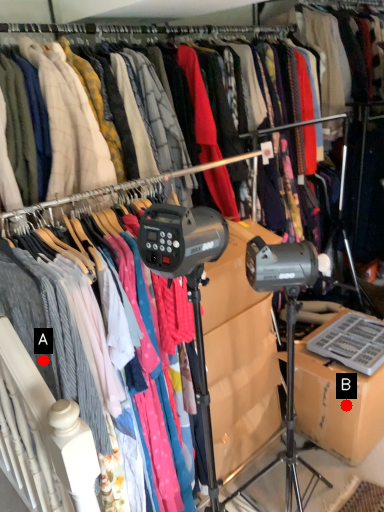
Question: Two points are circled on the image, labeled by A and B beside each circle. Among these points, which one is farthest from the camera?

Choices:
 (A) A is further
 (B) B is further

Answer: (B)